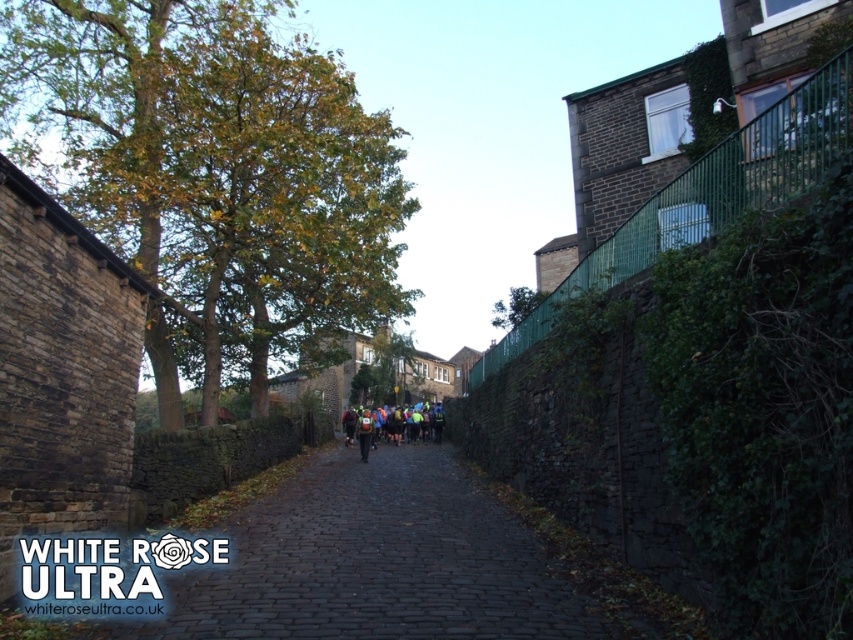
Question: Among these points, which one is nearest to the camera?

Choices:
 (A) (393, 422)
 (B) (596, 634)

Answer: (B)

Question: Is dark cobblestone path at center above reflective yellow jacket at center?

Choices:
 (A) no
 (B) yes

Answer: (B)

Question: Can you confirm if dark cobblestone path at center is positioned above reflective yellow jacket at center?

Choices:
 (A) no
 (B) yes

Answer: (B)

Question: Among these objects, which one is farthest from the camera?

Choices:
 (A) reflective yellow jacket at center
 (B) dark cobblestone path at center

Answer: (A)

Question: Considering the relative positions of dark cobblestone path at center and reflective yellow jacket at center in the image provided, where is dark cobblestone path at center located with respect to reflective yellow jacket at center?

Choices:
 (A) above
 (B) below

Answer: (A)

Question: Among these objects, which one is nearest to the camera?

Choices:
 (A) dark cobblestone path at center
 (B) reflective yellow jacket at center

Answer: (A)